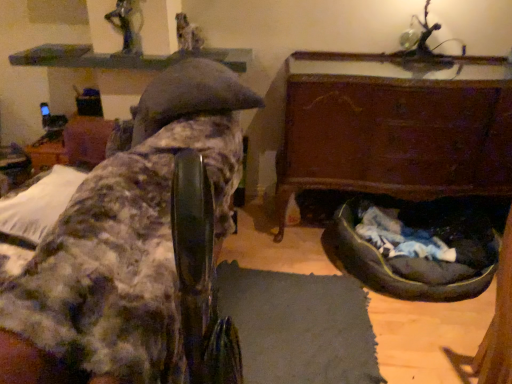
Question: Which direction should I rotate to face metallic statue at upper center, acting as the 2th person starting from the right, — up or down?

Choices:
 (A) up
 (B) down

Answer: (A)

Question: From the image's perspective, is metallic statue at upper center, acting as the 2th person starting from the right, below dark gray fabric dog bed at lower right?

Choices:
 (A) no
 (B) yes

Answer: (A)

Question: Considering the relative sizes of metallic statue at upper center, the second person when ordered from back to front, and dark gray fabric dog bed at lower right in the image provided, is metallic statue at upper center, the second person when ordered from back to front, shorter than dark gray fabric dog bed at lower right?

Choices:
 (A) no
 (B) yes

Answer: (B)

Question: Is metallic statue at upper center, which is counted as the 1th person, starting from the left, smaller than dark gray fabric dog bed at lower right?

Choices:
 (A) no
 (B) yes

Answer: (B)

Question: From the image's perspective, is metallic statue at upper center, acting as the 2th person starting from the right, above dark gray fabric dog bed at lower right?

Choices:
 (A) no
 (B) yes

Answer: (B)

Question: Would you say metallic statue at upper center, which is counted as the 1th person, starting from the left, contains dark gray fabric dog bed at lower right?

Choices:
 (A) no
 (B) yes

Answer: (A)

Question: Can we say metallic statue at upper center, which is counted as the 1th person, starting from the left, lies outside dark gray fabric dog bed at lower right?

Choices:
 (A) yes
 (B) no

Answer: (A)

Question: Can you confirm if smooth gray statue at upper center, which is the 1th person in back-to-front order, is thinner than metallic statue at upper center, arranged as the 1th person when viewed from the front?

Choices:
 (A) yes
 (B) no

Answer: (B)

Question: From the image's perspective, is smooth gray statue at upper center, which is the 1th person in back-to-front order, under metallic statue at upper center, acting as the 2th person starting from the right?

Choices:
 (A) no
 (B) yes

Answer: (A)

Question: Considering the relative sizes of smooth gray statue at upper center, the 1th person when ordered from right to left, and metallic statue at upper center, acting as the 2th person starting from the right, in the image provided, is smooth gray statue at upper center, the 1th person when ordered from right to left, bigger than metallic statue at upper center, acting as the 2th person starting from the right,?

Choices:
 (A) no
 (B) yes

Answer: (A)

Question: Does smooth gray statue at upper center, which is the second person in front-to-back order, turn towards metallic statue at upper center, arranged as the 1th person when viewed from the front?

Choices:
 (A) yes
 (B) no

Answer: (B)

Question: Is metallic statue at upper center, the second person when ordered from back to front, a part of smooth gray statue at upper center, which is the second person in front-to-back order?

Choices:
 (A) no
 (B) yes

Answer: (A)

Question: From a real-world perspective, is smooth gray statue at upper center, which is the 1th person in back-to-front order, below metallic statue at upper center, which is counted as the 1th person, starting from the left?

Choices:
 (A) yes
 (B) no

Answer: (A)

Question: From a real-world perspective, is fuzzy fabric chair at upper left, which ranks as the 1th furniture in left-to-right order, under dark gray fabric dog bed at lower right?

Choices:
 (A) no
 (B) yes

Answer: (A)